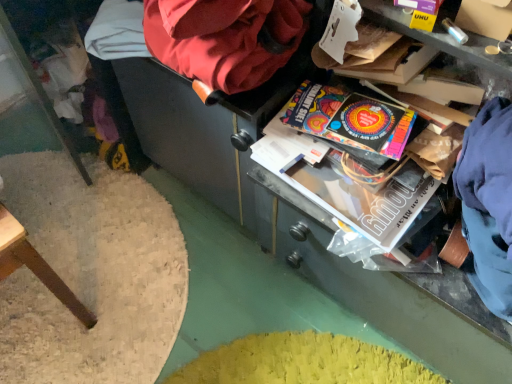
Question: Considering their positions, is velvet-like red bean bag chair at upper center located in front of or behind vibrant paper at center?

Choices:
 (A) behind
 (B) front

Answer: (B)

Question: In terms of height, does velvet-like red bean bag chair at upper center look taller or shorter compared to vibrant paper at center?

Choices:
 (A) short
 (B) tall

Answer: (B)

Question: In terms of size, does velvet-like red bean bag chair at upper center appear bigger or smaller than vibrant paper at center?

Choices:
 (A) small
 (B) big

Answer: (B)

Question: Considering the relative positions of vibrant paper at center and velvet-like red bean bag chair at upper center in the image provided, is vibrant paper at center to the left or to the right of velvet-like red bean bag chair at upper center?

Choices:
 (A) left
 (B) right

Answer: (B)

Question: Relative to velvet-like red bean bag chair at upper center, is vibrant paper at center in front or behind?

Choices:
 (A) behind
 (B) front

Answer: (A)

Question: In terms of size, does vibrant paper at center appear bigger or smaller than velvet-like red bean bag chair at upper center?

Choices:
 (A) small
 (B) big

Answer: (A)

Question: Looking at their shapes, would you say vibrant paper at center is wider or thinner than velvet-like red bean bag chair at upper center?

Choices:
 (A) thin
 (B) wide

Answer: (A)